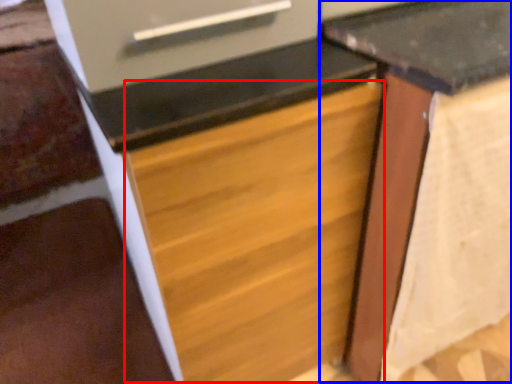
Question: Which object is further to the camera taking this photo, drawer (highlighted by a red box) or table (highlighted by a blue box)?

Choices:
 (A) drawer
 (B) table

Answer: (B)